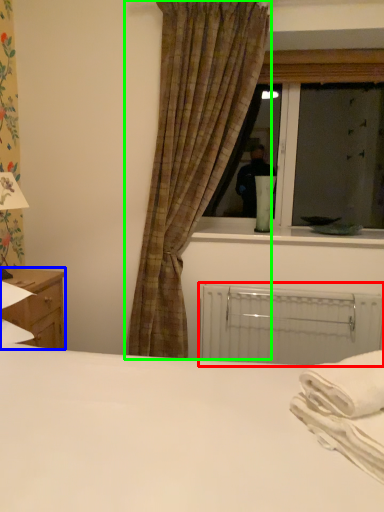
Question: Based on their relative distances, which object is farther from radiator (highlighted by a red box)? Choose from nightstand (highlighted by a blue box) and curtain (highlighted by a green box).

Choices:
 (A) nightstand
 (B) curtain

Answer: (A)